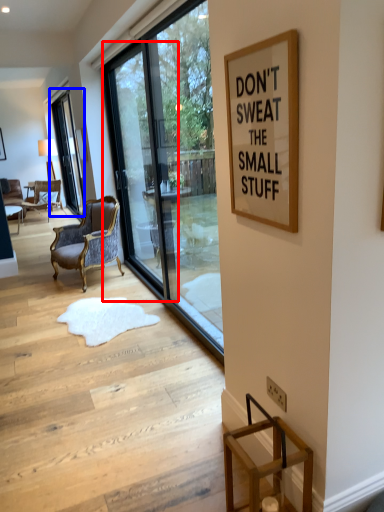
Question: Which object is further to the camera taking this photo, screen door (highlighted by a red box) or window (highlighted by a blue box)?

Choices:
 (A) screen door
 (B) window

Answer: (B)